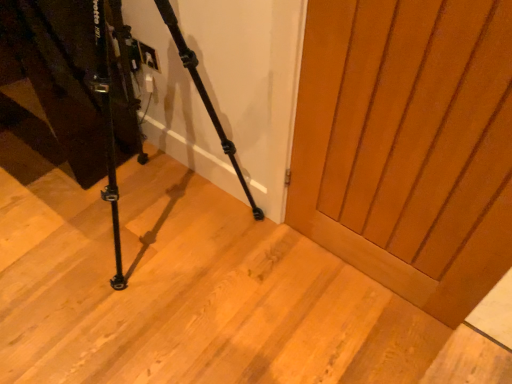
Question: Should I look upward or downward to see matte wood door at center?

Choices:
 (A) up
 (B) down

Answer: (A)

Question: Can you confirm if black matte tripod at lower left is smaller than matte wood door at center?

Choices:
 (A) no
 (B) yes

Answer: (A)

Question: Is black matte tripod at lower left to the right of matte wood door at center from the viewer's perspective?

Choices:
 (A) yes
 (B) no

Answer: (B)

Question: Does black matte tripod at lower left have a greater height compared to matte wood door at center?

Choices:
 (A) no
 (B) yes

Answer: (B)

Question: From a real-world perspective, is black matte tripod at lower left located beneath matte wood door at center?

Choices:
 (A) no
 (B) yes

Answer: (A)

Question: Is black matte tripod at lower left shorter than matte wood door at center?

Choices:
 (A) no
 (B) yes

Answer: (A)

Question: Does black matte tripod at lower left have a greater width compared to matte wood door at center?

Choices:
 (A) no
 (B) yes

Answer: (B)

Question: Considering the relative positions of matte wood door at center and black matte tripod at lower left in the image provided, is matte wood door at center to the left of black matte tripod at lower left from the viewer's perspective?

Choices:
 (A) yes
 (B) no

Answer: (B)

Question: Does matte wood door at center have a lesser height compared to black matte tripod at lower left?

Choices:
 (A) yes
 (B) no

Answer: (A)

Question: Considering the relative positions of matte wood door at center and black matte tripod at lower left in the image provided, is matte wood door at center behind black matte tripod at lower left?

Choices:
 (A) yes
 (B) no

Answer: (A)

Question: Can we say matte wood door at center lies outside black matte tripod at lower left?

Choices:
 (A) yes
 (B) no

Answer: (A)

Question: From the image's perspective, is matte wood door at center over black matte tripod at lower left?

Choices:
 (A) yes
 (B) no

Answer: (B)

Question: Is matte wood door at center to the right of black matte tripod at lower left from the viewer's perspective?

Choices:
 (A) no
 (B) yes

Answer: (B)

Question: From a real-world perspective, is matte wood door at center above or below black matte tripod at lower left?

Choices:
 (A) above
 (B) below

Answer: (B)